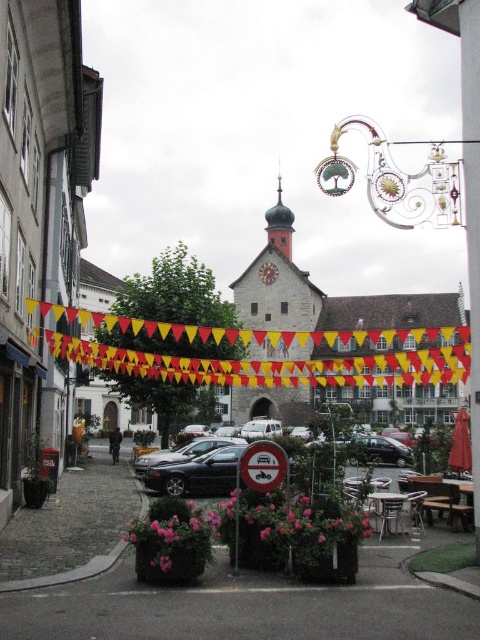
Question: In this image, where is shiny black car at center located relative to red plastic sign at center?

Choices:
 (A) below
 (B) above

Answer: (A)

Question: Among these points, which one is farthest from the camera?

Choices:
 (A) (286, 474)
 (B) (220, 456)
 (C) (435, 445)

Answer: (C)

Question: Among these objects, which one is nearest to the camera?

Choices:
 (A) red plastic sign at center
 (B) shiny black car at center

Answer: (A)

Question: Does shiny black sedan at center have a lesser width compared to shiny black car at center?

Choices:
 (A) yes
 (B) no

Answer: (B)

Question: Is shiny black sedan at center wider than shiny black car at center?

Choices:
 (A) no
 (B) yes

Answer: (B)

Question: Which of the following is the farthest from the observer?

Choices:
 (A) shiny black car at center
 (B) red plastic sign at center
 (C) shiny black sedan at center

Answer: (A)